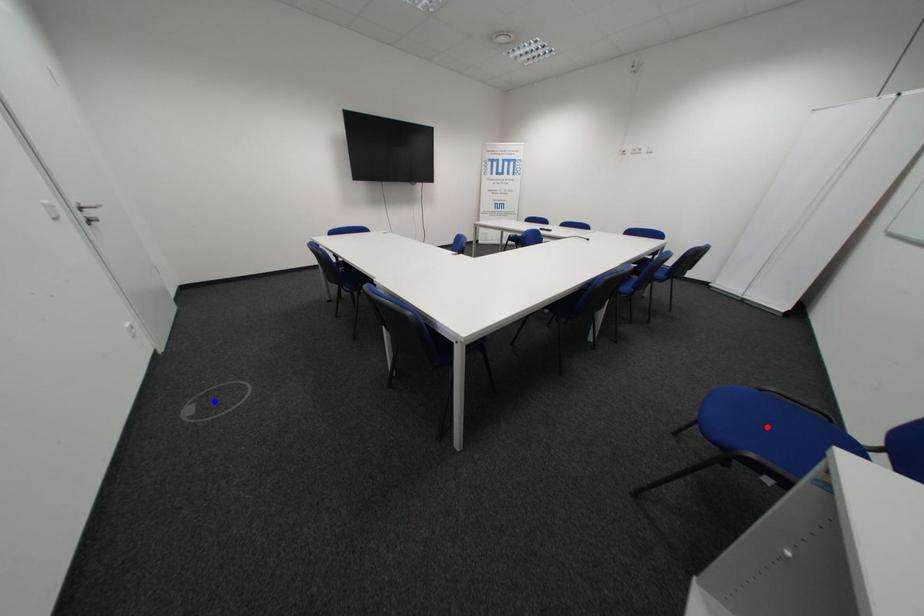
Question: Which of the two points in the image is closer to the camera?

Choices:
 (A) Blue point is closer.
 (B) Red point is closer.

Answer: (B)